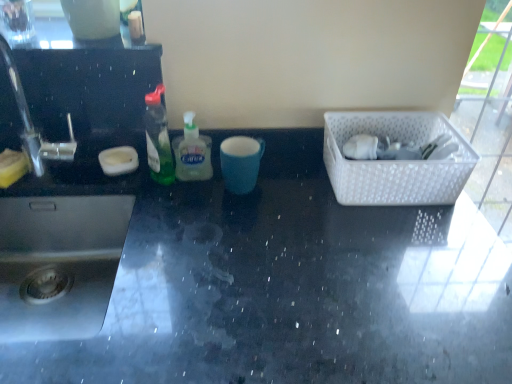
Locate an element on the screen. The height and width of the screenshot is (384, 512). vacant area that lies between white plastic basket at right and translucent green liquid soap at center, marked as the first bottle in a right-to-left arrangement is located at coordinates (287, 179).